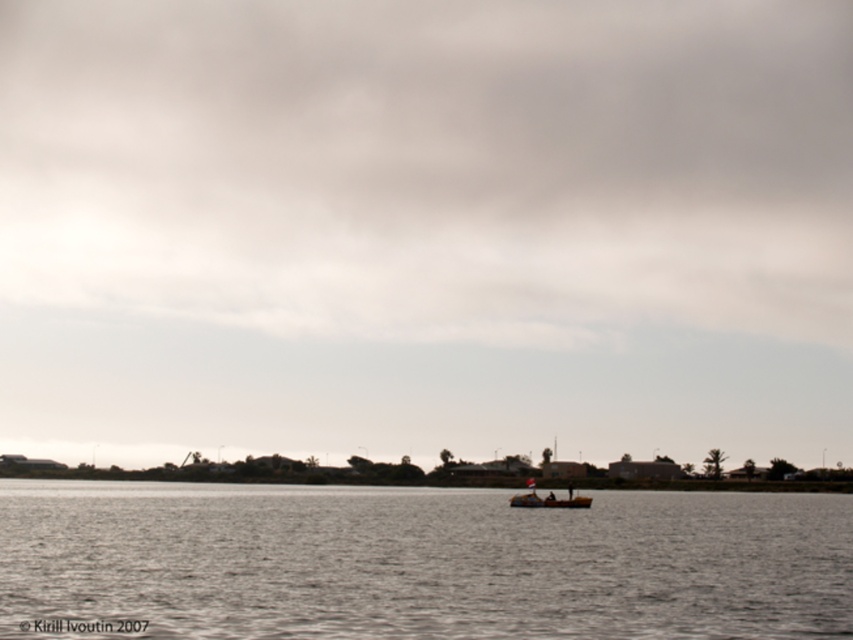
You are standing at the edge of the water and want to place a buoy at the exact center of the gray water at center. According to the coordinates provided, where should you place the buoy?

The gray water at center should have the buoy placed at point (416,563) as specified.

You are standing on the dock and see two points marked in the water. The first point is at coordinates point (601,432) and the second point is at point (354,540). Which point is closer to you?

Point (601,432) is further to the camera than point (354,540), so the second point is closer to you.

You are an observer looking at the water scene. Which object, the matte gray sky at center or the wooden boat at center, has a larger width?

The matte gray sky at center might be wider than wooden boat at center according to the description.